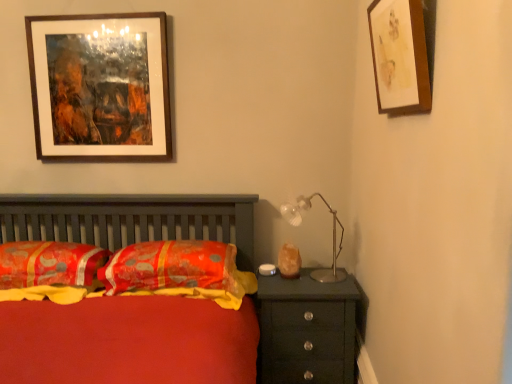
Find the location of `free region under metallic silver table lamp at upper right (from a real-world perspective)`. free region under metallic silver table lamp at upper right (from a real-world perspective) is located at coordinates (316, 279).